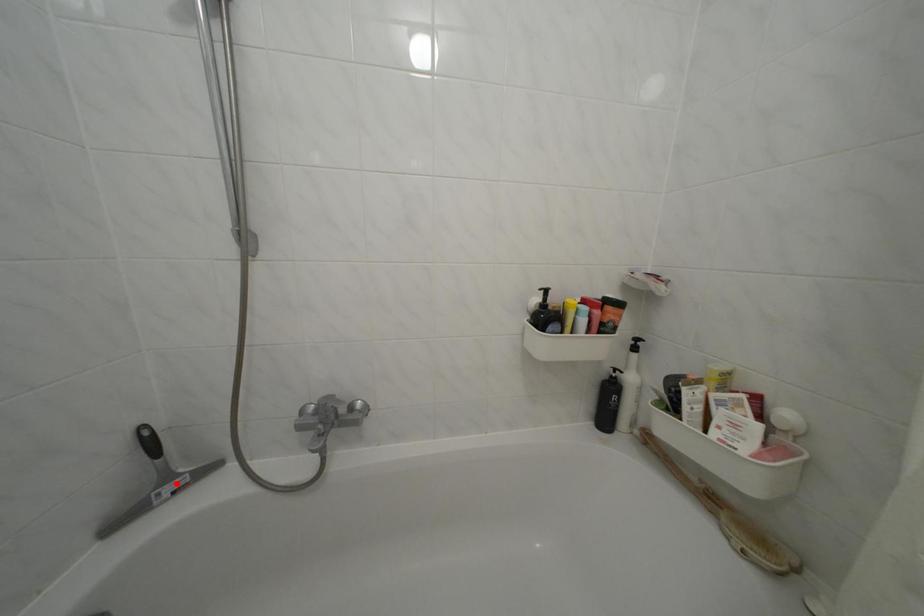
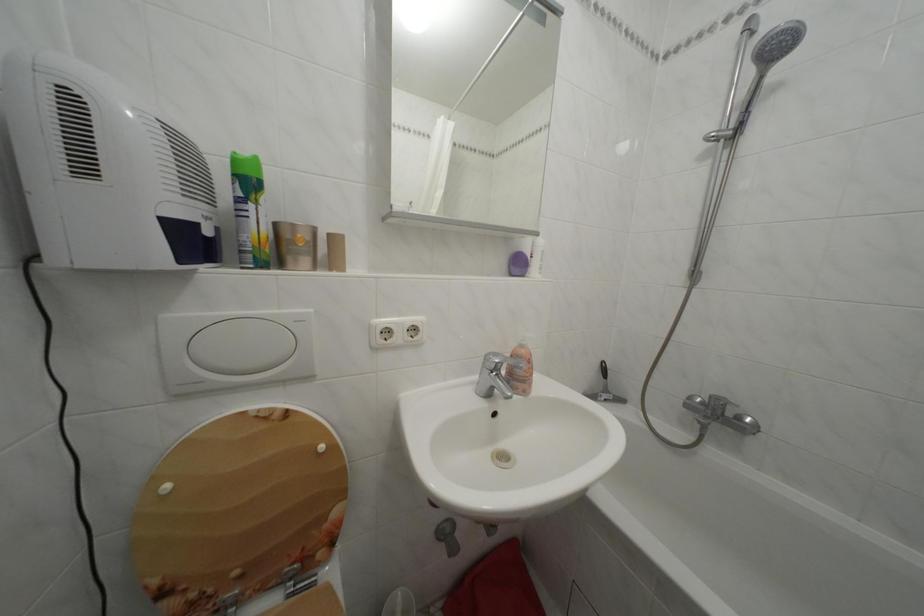
Where in the second image is the point corresponding to the highlighted location from the first image?

(614, 397)